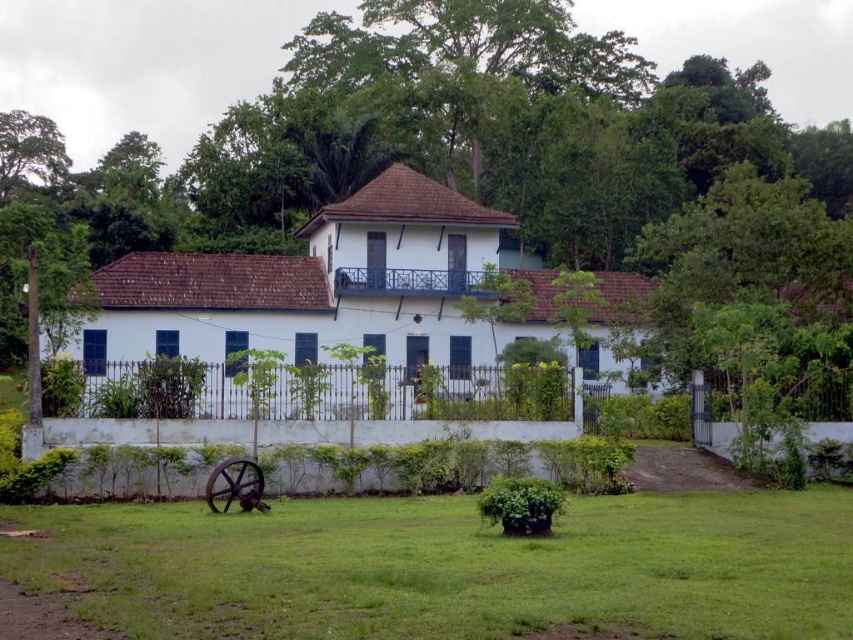
You are standing in the garden and want to plant a new flower bed. The flower bed needs to be placed where it can receive sunlight from the green leafy tree at upper left. Based on their positions, where should you place the flower bed relative to the green grass at lower center?

The green grass at lower center is below the green leafy tree at upper left, so placing the flower bed above the green grass at lower center would position it closer to the tree and likely receive more sunlight from the green leafy tree at upper left.